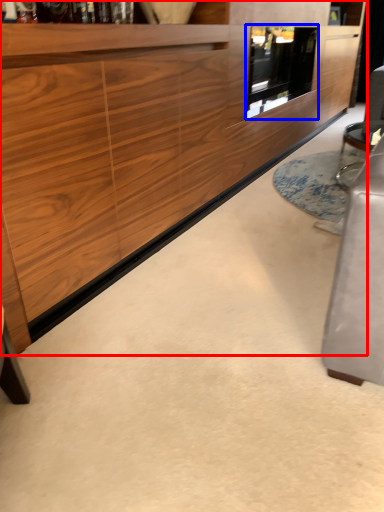
Question: Which point is closer to the camera, cabinetry (highlighted by a red box) or glass door (highlighted by a blue box)?

Choices:
 (A) cabinetry
 (B) glass door

Answer: (A)